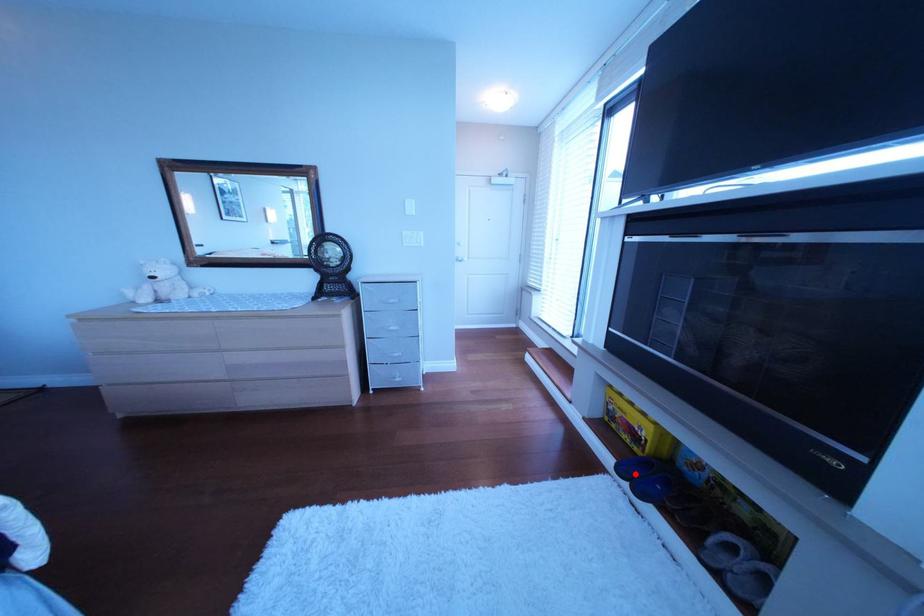
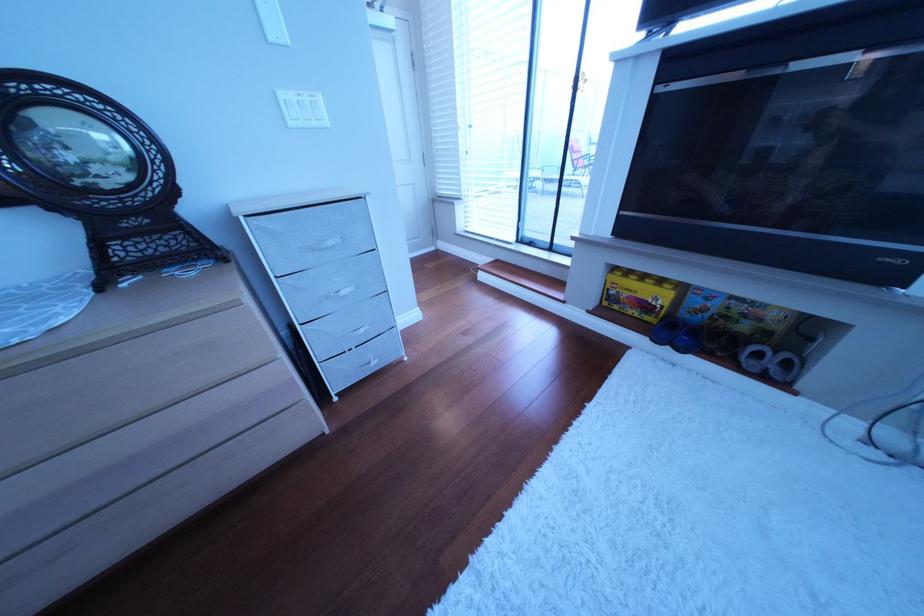
Where in the second image is the point corresponding to the highlighted location from the first image?

(673, 342)